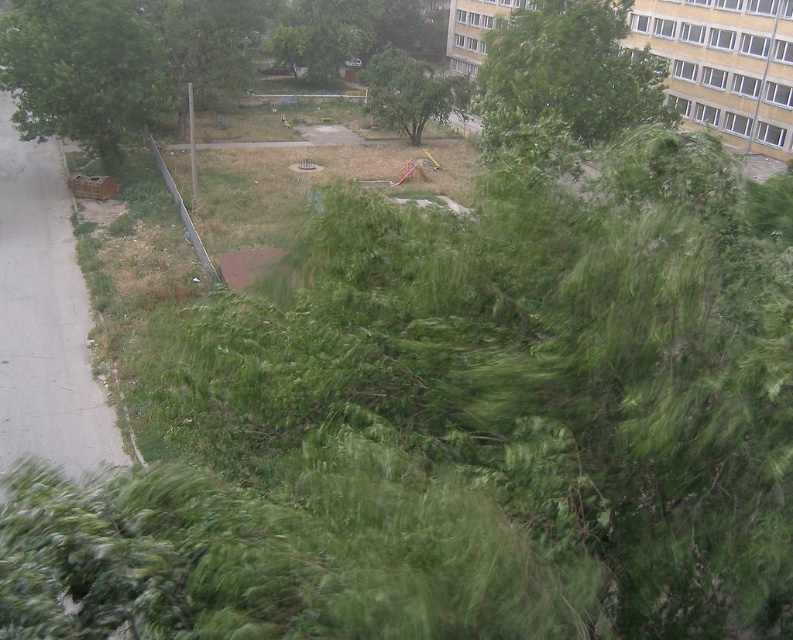
Does green leafy tree at left have a greater width compared to green leafy tree at center?

No.

Can you confirm if green leafy tree at left is bigger than green leafy tree at center?

No.

Is point (148, 26) positioned in front of point (370, 65)?

That is True.

At what (x,y) coordinates should I click in order to perform the action: click on green leafy tree at left. Please return your answer as a coordinate pair (x, y). This screenshot has height=640, width=793. Looking at the image, I should click on (82, 72).

The width and height of the screenshot is (793, 640). Identify the location of green leafy tree at upper center. (569, 72).

Can you confirm if green leafy tree at upper center is positioned to the right of green leafy tree at center?

Yes, green leafy tree at upper center is to the right of green leafy tree at center.

Does point (648, 70) lie in front of point (405, 93)?

Yes, point (648, 70) is closer to viewer.

At what (x,y) coordinates should I click in order to perform the action: click on green leafy tree at upper center. Please return your answer as a coordinate pair (x, y). Looking at the image, I should click on [569, 72].

Is green leafy tree at left to the right of green leafy tree at upper center from the viewer's perspective?

Incorrect, green leafy tree at left is not on the right side of green leafy tree at upper center.

Measure the distance between point (x=117, y=156) and camera.

Point (x=117, y=156) is 43.59 meters from camera.

You are a GUI agent. You are given a task and a screenshot of the screen. Output one action in this format:
    pyautogui.click(x=<x>, y=<y>)
    Task: Click on the green leafy tree at left
    
    Given the screenshot: What is the action you would take?
    pyautogui.click(x=82, y=72)

Where is `green leafy tree at left`? green leafy tree at left is located at coordinates (82, 72).